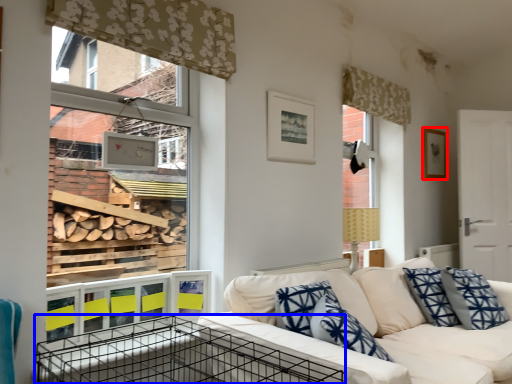
Question: Which object is closer to the camera taking this photo, picture frame (highlighted by a red box) or crate (highlighted by a blue box)?

Choices:
 (A) picture frame
 (B) crate

Answer: (B)